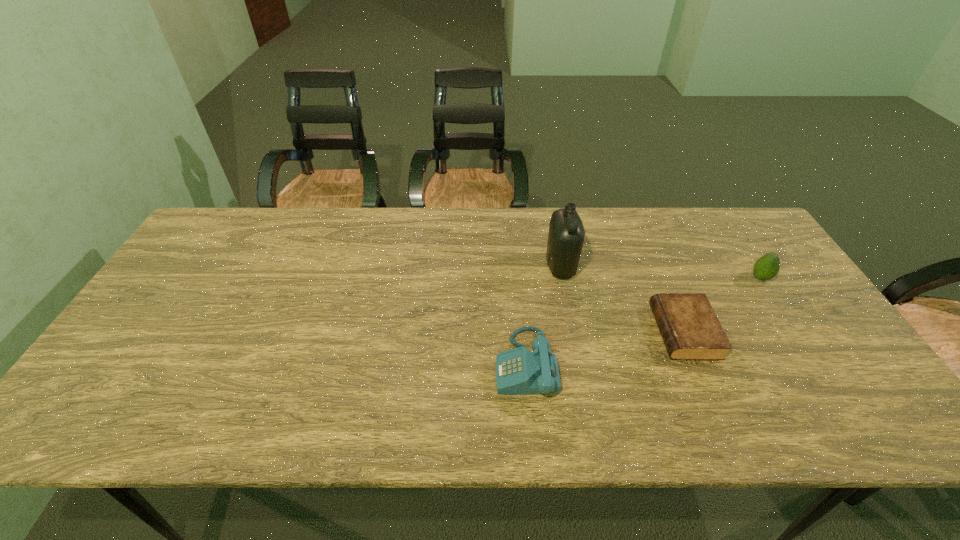
The image size is (960, 540). I want to click on vacant space situated 0.240m on the dial of the telephone, so click(x=396, y=364).

This screenshot has width=960, height=540. In order to click on vacant space located on the spine side of the second object from right to left in this screenshot , I will do `click(622, 332)`.

You are a GUI agent. You are given a task and a screenshot of the screen. Output one action in this format:
    pyautogui.click(x=<x>, y=<y>)
    Task: Click on the vacant space situated 0.110m on the spine side of the second object from right to left
    The image size is (960, 540).
    Given the screenshot: What is the action you would take?
    (614, 332)

This screenshot has width=960, height=540. In order to click on free location located on the spine side of the second object from right to left in this screenshot , I will do `click(599, 332)`.

Locate an element on the screen. This screenshot has height=540, width=960. object that is positioned at the far edge is located at coordinates point(566,235).

In order to click on object present at the near edge in this screenshot , I will do point(518,371).

Image resolution: width=960 pixels, height=540 pixels. I want to click on object that is positioned at the right edge, so click(x=767, y=267).

Locate an element on the screen. vacant space at the far edge of the desktop is located at coordinates (688, 209).

You are a GUI agent. You are given a task and a screenshot of the screen. Output one action in this format:
    pyautogui.click(x=<x>, y=<y>)
    Task: Click on the vacant space at the near edge of the desktop
    
    Given the screenshot: What is the action you would take?
    pyautogui.click(x=175, y=402)

Where is `free location at the left edge of the desktop`? free location at the left edge of the desktop is located at coordinates (166, 301).